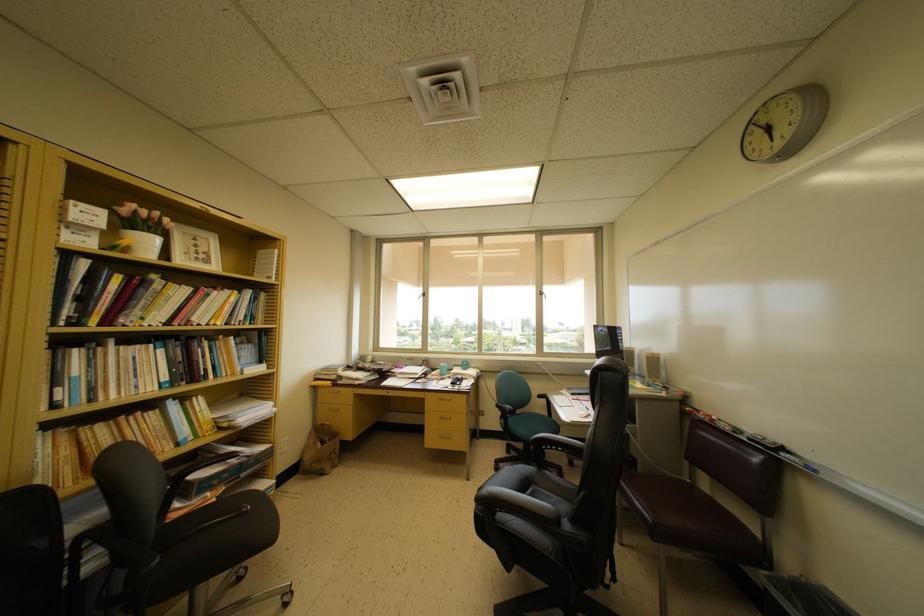
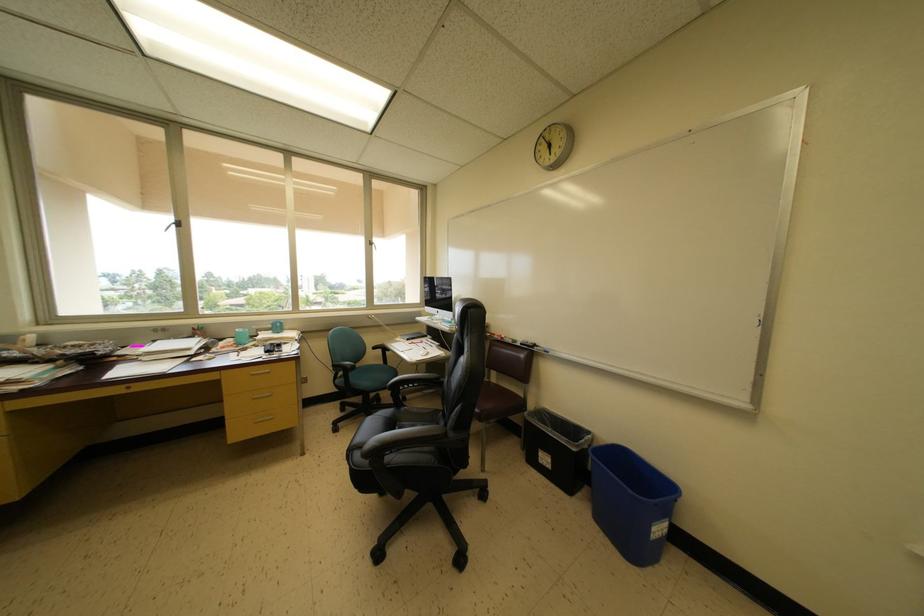
Question: Based on the continuous images, in which direction is the camera rotating? Reply with the corresponding letter.

Choices:
 (A) Left
 (B) Right
 (C) Up
 (D) Down

Answer: (B)